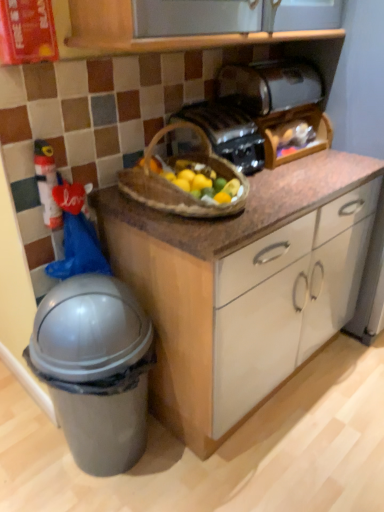
Find the location of `blank space situated above matte black toaster at center, the 2th toaster when ordered from top to bottom (from a real-world perspective)`. blank space situated above matte black toaster at center, the 2th toaster when ordered from top to bottom (from a real-world perspective) is located at coordinates (205, 108).